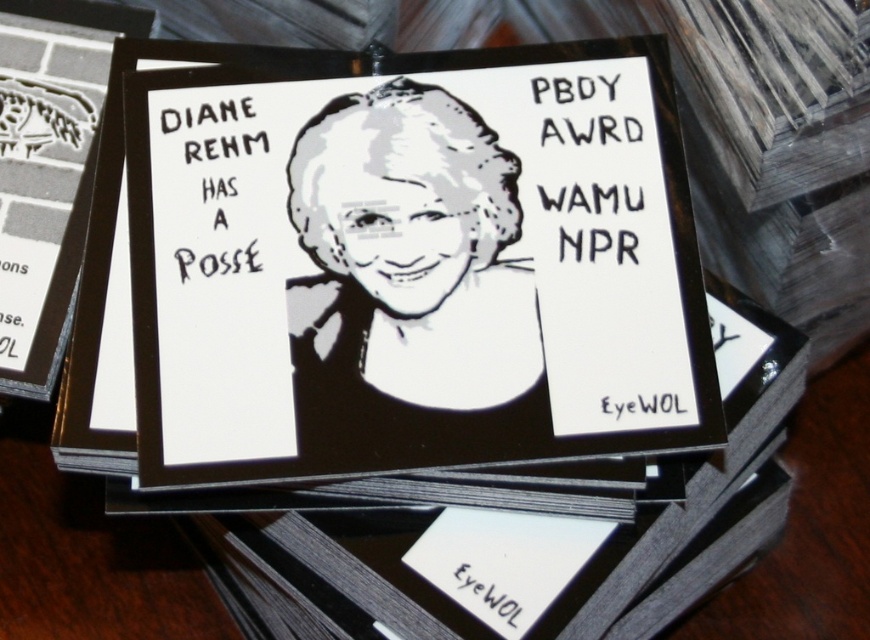
Question: Can you confirm if black paper card at center is wider than black paper portrait at center?

Choices:
 (A) yes
 (B) no

Answer: (A)

Question: Is the position of black paper card at center less distant than that of black paper portrait at center?

Choices:
 (A) no
 (B) yes

Answer: (B)

Question: Which of the following is the closest to the observer?

Choices:
 (A) (416, 173)
 (B) (420, 122)

Answer: (A)

Question: Which point is closer to the camera?

Choices:
 (A) (373, 157)
 (B) (336, 292)

Answer: (B)

Question: Is black paper card at center to the right of black paper portrait at center from the viewer's perspective?

Choices:
 (A) yes
 (B) no

Answer: (A)

Question: Among these objects, which one is farthest from the camera?

Choices:
 (A) black paper portrait at center
 (B) black paper card at center

Answer: (A)